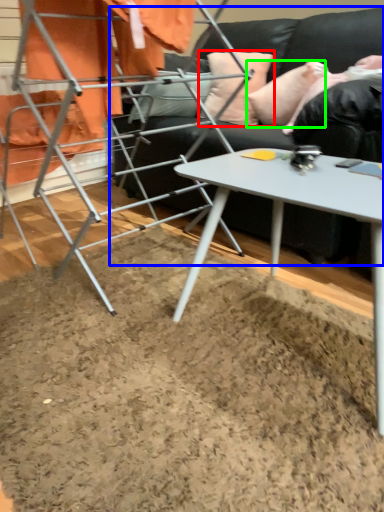
Question: Which object is the closest to the pillow (highlighted by a red box)? Choose among these: studio couch (highlighted by a blue box) or pillow (highlighted by a green box).

Choices:
 (A) studio couch
 (B) pillow

Answer: (B)